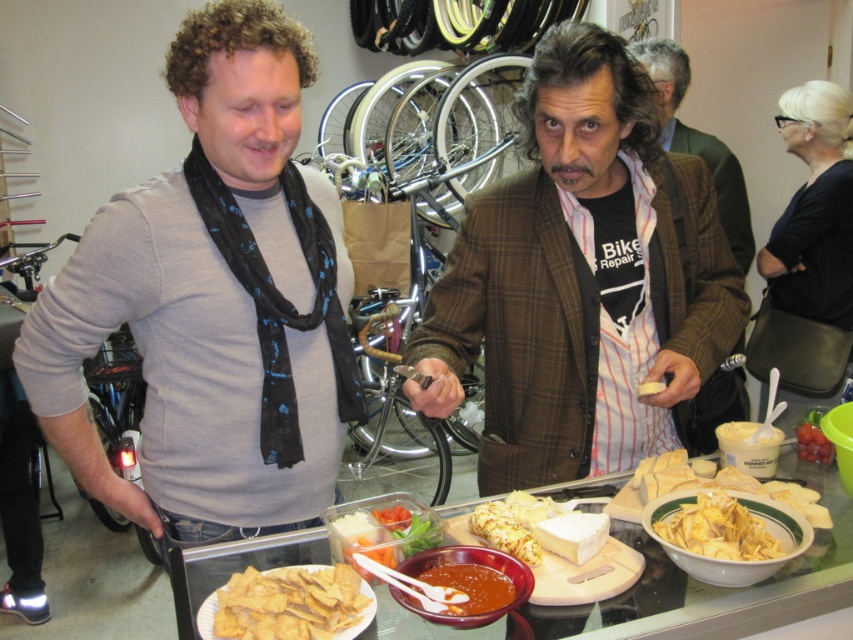
Question: Which point is farther to the camera?

Choices:
 (A) white creamy cheese at center
 (B) gray matte shirt at left
 (C) brown plaid blazer at center

Answer: (A)

Question: Which point appears closest to the camera in this image?

Choices:
 (A) (103, 468)
 (B) (637, 392)

Answer: (B)

Question: Is the position of plaid wool jacket at center less distant than that of white cheese at center?

Choices:
 (A) no
 (B) yes

Answer: (A)

Question: Is translucent plastic container at center below thick brown sauce at center?

Choices:
 (A) yes
 (B) no

Answer: (B)

Question: Among these objects, which one is farthest from the camera?

Choices:
 (A) gray matte shirt at left
 (B) plaid wool jacket at center

Answer: (B)

Question: Where is translucent plastic container at center located in relation to white creamy cheese at center in the image?

Choices:
 (A) above
 (B) below

Answer: (B)